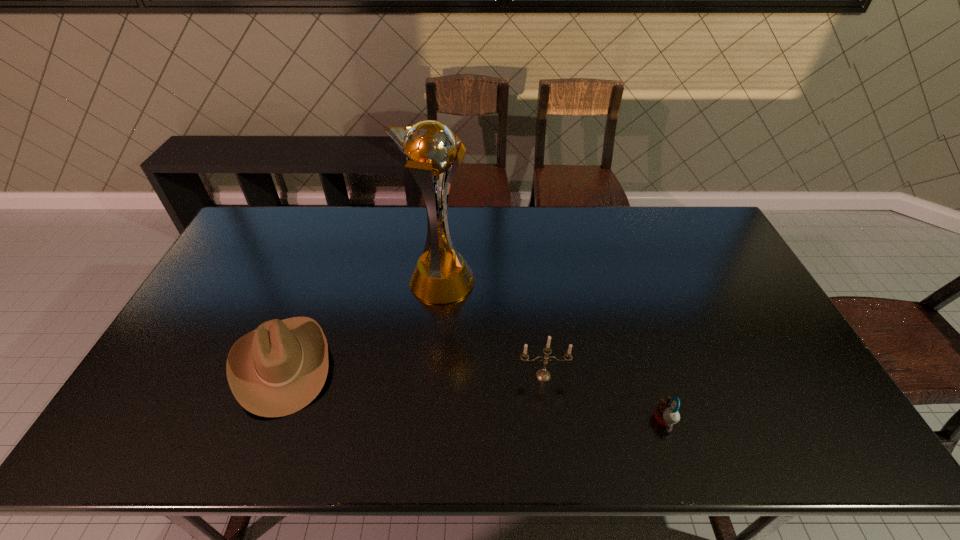
This screenshot has height=540, width=960. In the image, there is a desktop. Find the location of `blank space at the far right corner`. blank space at the far right corner is located at coordinates (708, 242).

You are a GUI agent. You are given a task and a screenshot of the screen. Output one action in this format:
    pyautogui.click(x=<x>, y=<y>)
    Task: Click on the free space between the third object from right to left and the leftmost object
    Image resolution: width=960 pixels, height=540 pixels.
    Given the screenshot: What is the action you would take?
    pyautogui.click(x=361, y=323)

The image size is (960, 540). I want to click on free space between the tallest object and the muffin, so pyautogui.click(x=552, y=351).

The image size is (960, 540). I want to click on free space between the trophy and the candle, so click(x=492, y=329).

Locate an element on the screen. The height and width of the screenshot is (540, 960). empty location between the leftmost object and the candle is located at coordinates (413, 370).

Locate an element on the screen. The width and height of the screenshot is (960, 540). free spot between the third object from left to right and the leftmost object is located at coordinates 413,370.

This screenshot has width=960, height=540. What are the coordinates of `unoccupied position between the rightmost object and the second object from right to left` in the screenshot? It's located at (604, 397).

Image resolution: width=960 pixels, height=540 pixels. What are the coordinates of `vacant space that is in between the shortest object and the leftmost object` in the screenshot? It's located at (473, 392).

Where is `vacant area that lies between the rightmost object and the cowboy hat`? The height and width of the screenshot is (540, 960). vacant area that lies between the rightmost object and the cowboy hat is located at coordinates (473, 392).

Where is `free space that is in between the rightmost object and the farthest object`? This screenshot has height=540, width=960. free space that is in between the rightmost object and the farthest object is located at coordinates (552, 351).